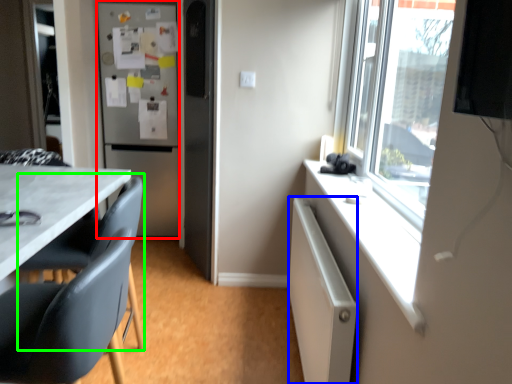
Question: Estimate the real-world distances between objects in this image. Which object is farther from refrigerator (highlighted by a red box), cabinetry (highlighted by a blue box) or swivel chair (highlighted by a green box)?

Choices:
 (A) cabinetry
 (B) swivel chair

Answer: (A)